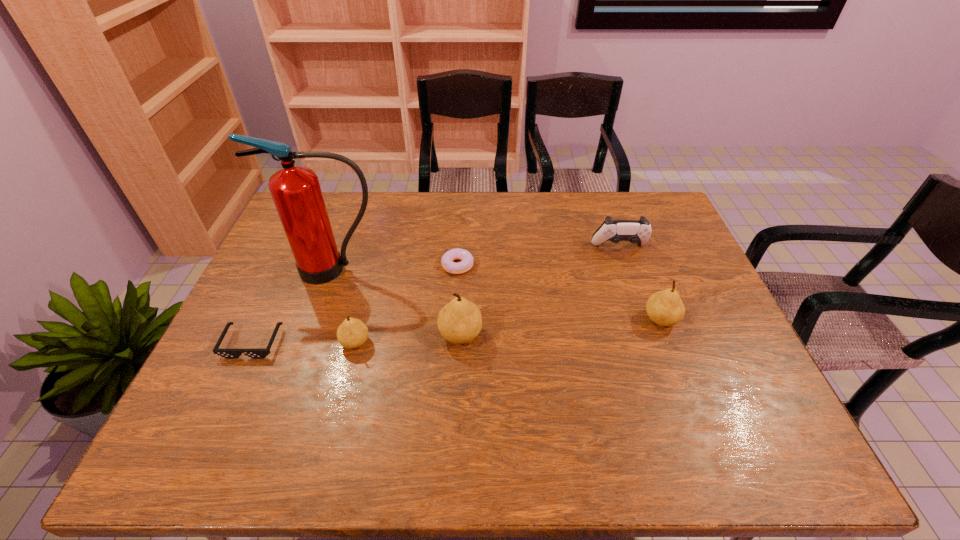
Find the location of a particular element. This screenshot has height=540, width=960. free space at the far edge of the desktop is located at coordinates (533, 200).

Find the location of a particular element. The height and width of the screenshot is (540, 960). vacant area at the near edge is located at coordinates (453, 413).

The image size is (960, 540). In the image, there is a desktop. In order to click on vacant space at the left edge in this screenshot , I will do `click(235, 328)`.

The image size is (960, 540). I want to click on vacant area at the right edge of the desktop, so pyautogui.click(x=696, y=308).

Locate an element on the screen. This screenshot has width=960, height=540. free space at the near left corner of the desktop is located at coordinates (190, 403).

In the image, there is a desktop. Where is `vacant space at the far right corner`? The height and width of the screenshot is (540, 960). vacant space at the far right corner is located at coordinates (656, 228).

The height and width of the screenshot is (540, 960). Identify the location of vacant region between the leftmost pear and the sixth shortest object. (408, 339).

Locate an element on the screen. Image resolution: width=960 pixels, height=540 pixels. vacant space that is in between the sunglasses and the doughnut is located at coordinates (355, 304).

I want to click on free space between the second pear from right to left and the leftmost pear, so click(408, 339).

The image size is (960, 540). What are the coordinates of `vacant point located between the control and the sunglasses` in the screenshot? It's located at [436, 295].